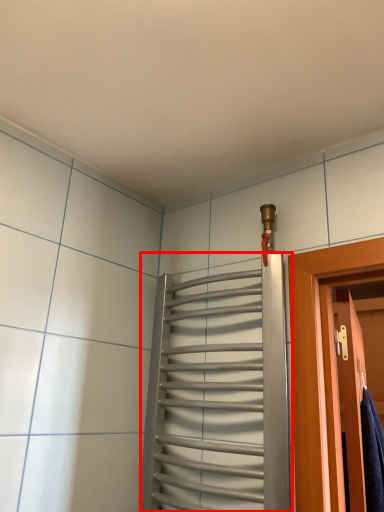
Question: From the image's perspective, what is the correct spatial relationship of elevator (annotated by the red box) in relation to door?

Choices:
 (A) above
 (B) below

Answer: (A)